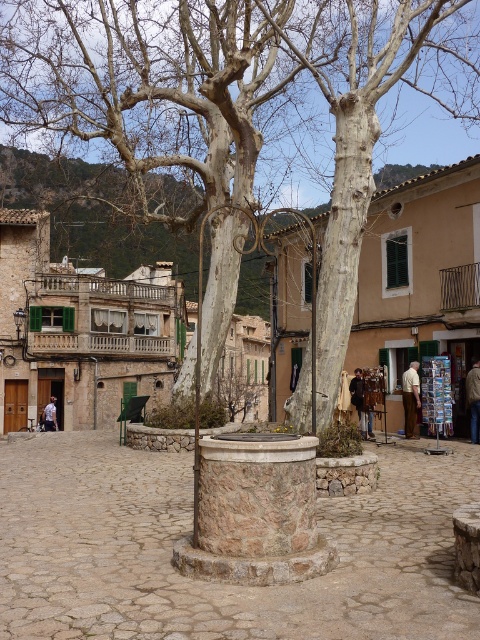
You are an artist planning to sketch the scene. You want to ensure the proportions of the smooth white tree at center and the smooth white bark at center are accurate. Which one should you draw larger?

The smooth white tree at center should be drawn larger since it has a larger size compared to the smooth white bark at center.

You are standing in the cobblestone square and want to find the light brown leather jacket at lower right. According to the scene description, where should you look?

The light brown leather jacket at lower right is located at the coordinates point (410, 396) in the scene.

You are a tourist visiting the cobblestone square and want to take a photo of the dark brown leather jacket at center. Where should you position yourself to capture it in the frame?

Position yourself so that the dark brown leather jacket at center is centered at coordinates approximately 0.628 on the x axis and 0.752 on the y axis to capture it in the frame.